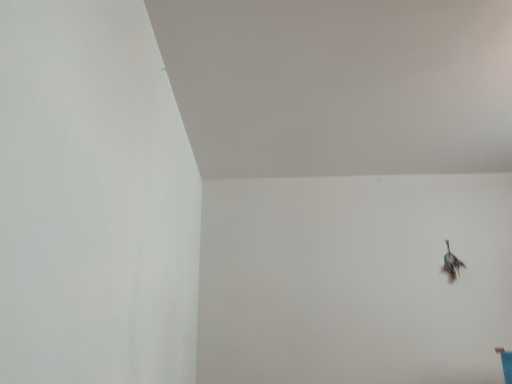
This screenshot has height=384, width=512. Describe the element at coordinates (451, 264) in the screenshot. I see `metallic wire at upper right` at that location.

Locate an element on the screen. metallic wire at upper right is located at coordinates (451, 264).

Locate an element on the screen. This screenshot has width=512, height=384. metallic wire at upper right is located at coordinates (451, 264).